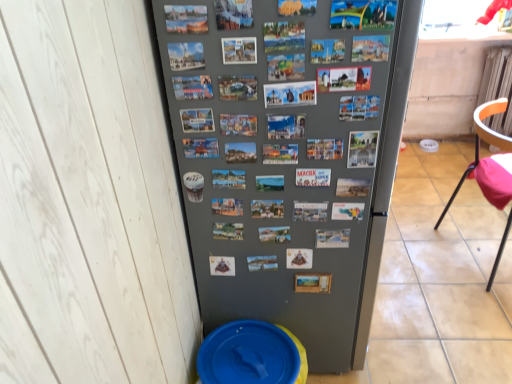
Question: Considering the relative sizes of orange plastic chair at right and gray matte refrigerator at center in the image provided, is orange plastic chair at right smaller than gray matte refrigerator at center?

Choices:
 (A) yes
 (B) no

Answer: (A)

Question: Is the depth of orange plastic chair at right greater than that of gray matte refrigerator at center?

Choices:
 (A) yes
 (B) no

Answer: (A)

Question: From a real-world perspective, is orange plastic chair at right located beneath gray matte refrigerator at center?

Choices:
 (A) yes
 (B) no

Answer: (A)

Question: From the image's perspective, would you say orange plastic chair at right is shown under gray matte refrigerator at center?

Choices:
 (A) no
 (B) yes

Answer: (B)

Question: Does orange plastic chair at right have a greater width compared to gray matte refrigerator at center?

Choices:
 (A) no
 (B) yes

Answer: (A)

Question: Can you confirm if orange plastic chair at right is thinner than gray matte refrigerator at center?

Choices:
 (A) yes
 (B) no

Answer: (A)

Question: From a real-world perspective, is orange plastic chair at right positioned under blue plastic potty at lower left based on gravity?

Choices:
 (A) yes
 (B) no

Answer: (B)

Question: Considering the relative sizes of orange plastic chair at right and blue plastic potty at lower left in the image provided, is orange plastic chair at right shorter than blue plastic potty at lower left?

Choices:
 (A) no
 (B) yes

Answer: (A)

Question: Does orange plastic chair at right appear on the right side of blue plastic potty at lower left?

Choices:
 (A) yes
 (B) no

Answer: (A)

Question: Is orange plastic chair at right closer to camera compared to blue plastic potty at lower left?

Choices:
 (A) no
 (B) yes

Answer: (A)

Question: Considering the relative sizes of orange plastic chair at right and blue plastic potty at lower left in the image provided, is orange plastic chair at right smaller than blue plastic potty at lower left?

Choices:
 (A) no
 (B) yes

Answer: (A)

Question: Does orange plastic chair at right have a greater width compared to blue plastic potty at lower left?

Choices:
 (A) yes
 (B) no

Answer: (A)

Question: Is blue plastic potty at lower left surrounding orange plastic chair at right?

Choices:
 (A) yes
 (B) no

Answer: (B)